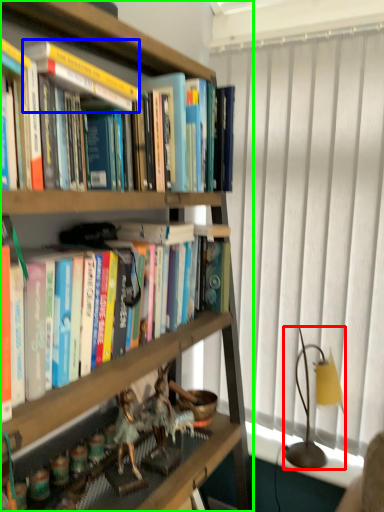
Question: Which object is positioned closest to lamp (highlighted by a red box)? Select from paperback book (highlighted by a blue box) and bookcase (highlighted by a green box).

Choices:
 (A) paperback book
 (B) bookcase

Answer: (A)